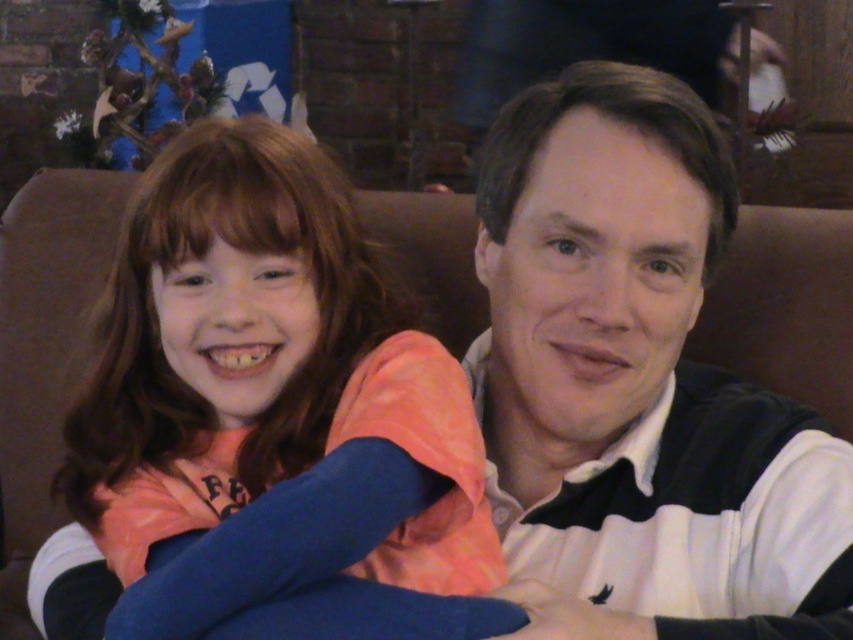
Question: Is orange fleece sweater at left smaller than white striped sweater at center?

Choices:
 (A) no
 (B) yes

Answer: (A)

Question: In this image, where is orange fleece sweater at left located relative to white striped sweater at center?

Choices:
 (A) above
 (B) below

Answer: (B)

Question: Is orange fleece sweater at left behind white striped sweater at center?

Choices:
 (A) yes
 (B) no

Answer: (B)

Question: Which object is closer to the camera taking this photo?

Choices:
 (A) orange fleece sweater at left
 (B) white striped sweater at center

Answer: (A)